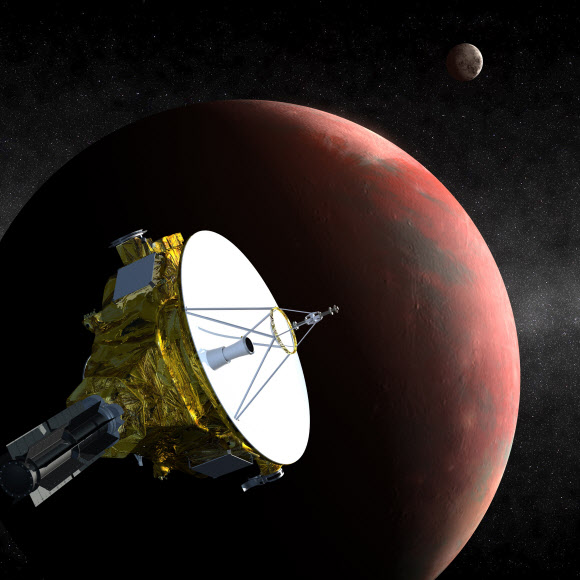
At what (x,y) coordinates should I click in order to perform the action: click on light. Please return your answer as a coordinate pair (x, y). This screenshot has width=580, height=580. Looking at the image, I should click on (540, 307), (438, 297), (482, 56).